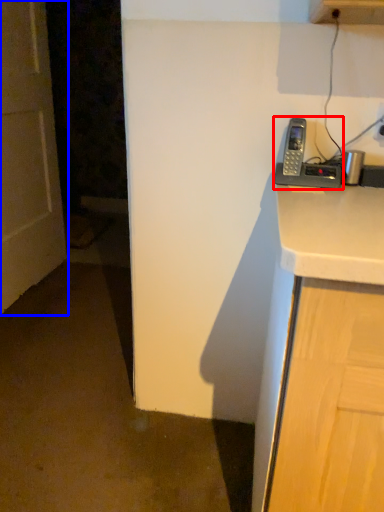
Question: Which of the following is the closest to the observer, corded phone (highlighted by a red box) or door (highlighted by a blue box)?

Choices:
 (A) corded phone
 (B) door

Answer: (A)